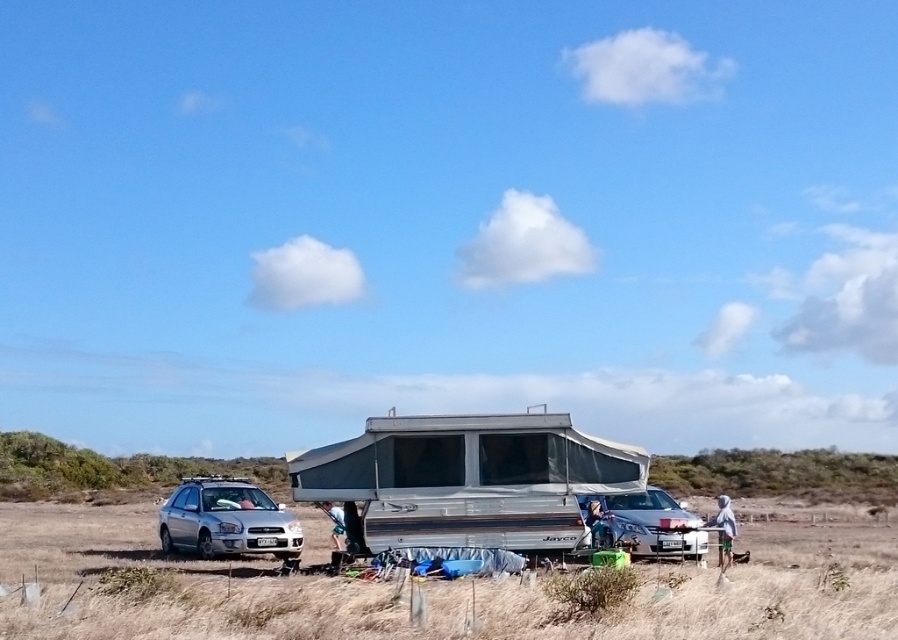
Question: Does silver metallic pop-up camper at center come in front of satin silver car at left?

Choices:
 (A) yes
 (B) no

Answer: (B)

Question: Which point appears farthest from the camera in this image?

Choices:
 (A) (276, 545)
 (B) (648, 540)
 (C) (437, 506)

Answer: (A)

Question: Among these objects, which one is nearest to the camera?

Choices:
 (A) silver metallic pop-up camper at center
 (B) satin silver car at left

Answer: (B)

Question: Which point is farther to the camera?

Choices:
 (A) satin silver car at center
 (B) satin silver car at left

Answer: (A)

Question: Is satin silver car at left above satin silver car at center?

Choices:
 (A) no
 (B) yes

Answer: (A)

Question: Considering the relative positions of satin silver car at left and satin silver car at center in the image provided, where is satin silver car at left located with respect to satin silver car at center?

Choices:
 (A) left
 (B) right

Answer: (A)